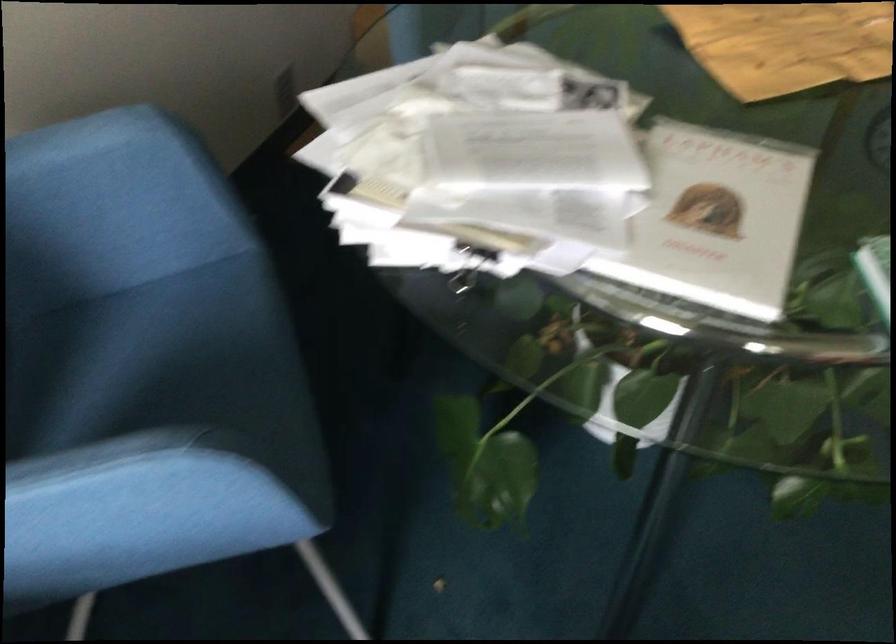
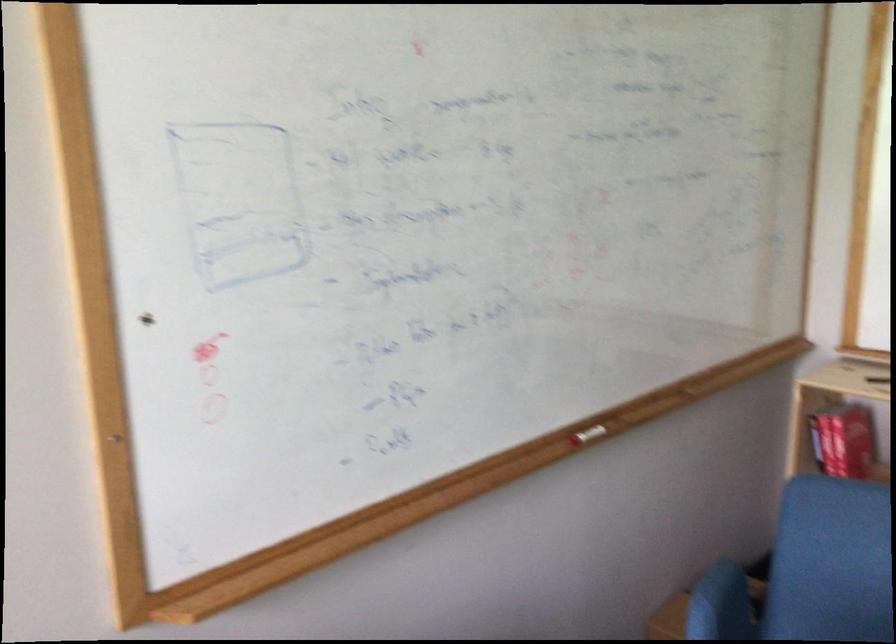
Looking at this image, first-person continuous shooting, in which direction is the camera rotating?

The camera's rotation is toward left-up.